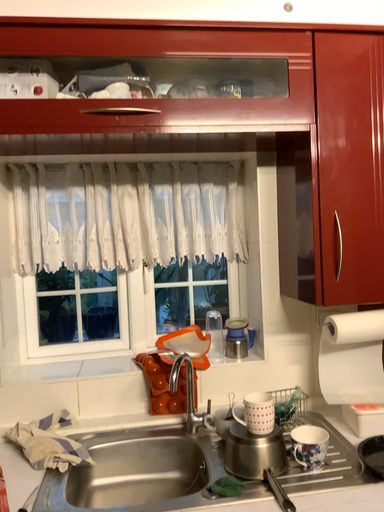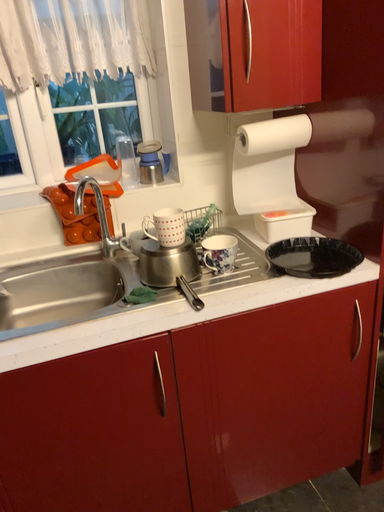
Question: Which way did the camera rotate in the video?

Choices:
 (A) rotated right
 (B) rotated left

Answer: (A)